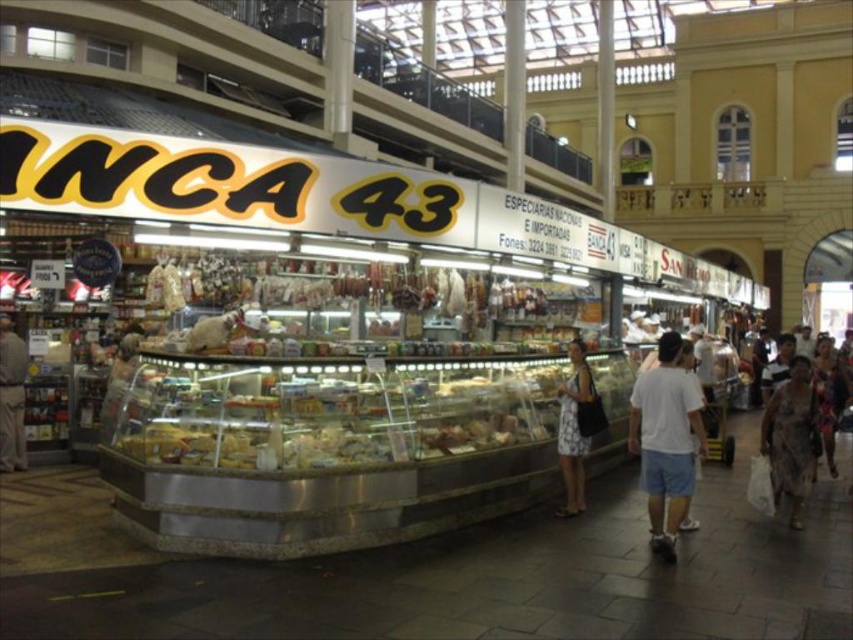
Question: Does white cotton shirt at right have a larger size compared to white floral dress at center?

Choices:
 (A) yes
 (B) no

Answer: (A)

Question: Which object is positioned closest to the white cotton shirt at right?

Choices:
 (A) patterned fabric dress at lower right
 (B) white floral dress at center
 (C) printed fabric dress at lower right

Answer: (B)

Question: Is white floral dress at center wider than light brown leather jacket at lower left?

Choices:
 (A) no
 (B) yes

Answer: (B)

Question: Does patterned fabric dress at lower right have a lesser width compared to light brown leather jacket at lower left?

Choices:
 (A) yes
 (B) no

Answer: (B)

Question: Which of the following is the farthest from the observer?

Choices:
 (A) printed fabric dress at lower right
 (B) white floral dress at center

Answer: (B)

Question: Which of the following is the closest to the observer?

Choices:
 (A) patterned fabric dress at lower right
 (B) light brown leather jacket at lower left
 (C) printed fabric dress at lower right

Answer: (A)